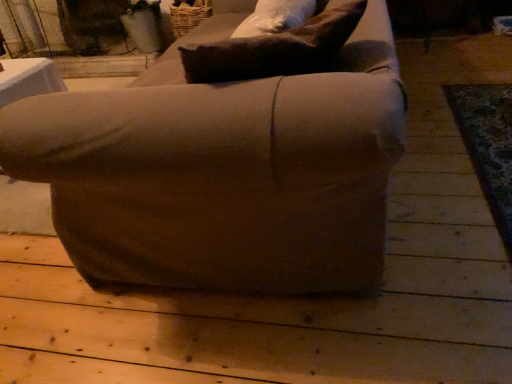
Where is `matte brown armchair at center`? The width and height of the screenshot is (512, 384). matte brown armchair at center is located at coordinates (223, 170).

Measure the distance between matte brown armchair at center and camera.

matte brown armchair at center and camera are 29.10 inches apart from each other.

This screenshot has width=512, height=384. What do you see at coordinates (223, 170) in the screenshot?
I see `matte brown armchair at center` at bounding box center [223, 170].

What do you see at coordinates (219, 62) in the screenshot? I see `brown fabric pillow at upper center` at bounding box center [219, 62].

The height and width of the screenshot is (384, 512). Find the location of `brown fabric pillow at upper center`. brown fabric pillow at upper center is located at coordinates (219, 62).

The width and height of the screenshot is (512, 384). Find the location of `matte brown armchair at center`. matte brown armchair at center is located at coordinates (223, 170).

In the image, is matte brown armchair at center on the left side or the right side of brown fabric pillow at upper center?

Based on their positions, matte brown armchair at center is located to the left of brown fabric pillow at upper center.

Which object is further away from the camera taking this photo, matte brown armchair at center or brown fabric pillow at upper center?

brown fabric pillow at upper center is more distant.

Does point (389, 150) come behind point (331, 48)?

No, it is not.

From the image's perspective, relative to brown fabric pillow at upper center, is matte brown armchair at center above or below?

matte brown armchair at center is above brown fabric pillow at upper center.

In the scene shown: From a real-world perspective, which object stands above the other?

brown fabric pillow at upper center, from a real-world perspective.

In terms of width, does matte brown armchair at center look wider or thinner when compared to brown fabric pillow at upper center?

Clearly, matte brown armchair at center has more width compared to brown fabric pillow at upper center.

Does matte brown armchair at center have a lesser height compared to brown fabric pillow at upper center?

Incorrect, the height of matte brown armchair at center does not fall short of that of brown fabric pillow at upper center.

Is matte brown armchair at center smaller than brown fabric pillow at upper center?

Incorrect, matte brown armchair at center is not smaller in size than brown fabric pillow at upper center.

In the scene shown: Would you say matte brown armchair at center is outside brown fabric pillow at upper center?

matte brown armchair at center lies outside brown fabric pillow at upper center's area.

Is matte brown armchair at center with brown fabric pillow at upper center?

There is a gap between matte brown armchair at center and brown fabric pillow at upper center.

Is matte brown armchair at center facing towards brown fabric pillow at upper center?

Yes.

Find the location of a particular element. Image resolution: width=512 pixels, height=384 pixels. chair below the brown fabric pillow at upper center (from a real-world perspective) is located at coordinates (223, 170).

Would you say brown fabric pillow at upper center is to the left or to the right of matte brown armchair at center in the picture?

From the image, it's evident that brown fabric pillow at upper center is to the right of matte brown armchair at center.

Which object is closer to the camera, brown fabric pillow at upper center or matte brown armchair at center?

matte brown armchair at center is more forward.

Which is closer, (222,79) or (237,140)?

Positioned in front is point (237,140).

From the image's perspective, is brown fabric pillow at upper center located above or below matte brown armchair at center?

brown fabric pillow at upper center is below matte brown armchair at center.

From a real-world perspective, does brown fabric pillow at upper center sit lower than matte brown armchair at center?

No.

Between brown fabric pillow at upper center and matte brown armchair at center, which one has larger width?

matte brown armchair at center is wider.

In terms of height, does brown fabric pillow at upper center look taller or shorter compared to matte brown armchair at center?

In the image, brown fabric pillow at upper center appears to be shorter than matte brown armchair at center.

Is brown fabric pillow at upper center bigger than matte brown armchair at center?

No, brown fabric pillow at upper center is not bigger than matte brown armchair at center.

Do you think brown fabric pillow at upper center is within matte brown armchair at center, or outside of it?

The correct answer is: inside.

From the picture: Are brown fabric pillow at upper center and matte brown armchair at center far apart?

No, brown fabric pillow at upper center is in close proximity to matte brown armchair at center.

Does brown fabric pillow at upper center turn towards matte brown armchair at center?

Yes.

How different are the orientations of brown fabric pillow at upper center and matte brown armchair at center in degrees?

0.000203 degrees.

You are a GUI agent. You are given a task and a screenshot of the screen. Output one action in this format:
    pyautogui.click(x=<x>, y=<y>)
    Task: Click on the chair in front of the brown fabric pillow at upper center
    This screenshot has height=384, width=512.
    Given the screenshot: What is the action you would take?
    pyautogui.click(x=223, y=170)

Find the location of a particular element. The width and height of the screenshot is (512, 384). chair beneath the brown fabric pillow at upper center (from a real-world perspective) is located at coordinates (223, 170).

You are a GUI agent. You are given a task and a screenshot of the screen. Output one action in this format:
    pyautogui.click(x=<x>, y=<y>)
    Task: Click on the pillow located on the right of matte brown armchair at center
    The image size is (512, 384).
    Given the screenshot: What is the action you would take?
    pyautogui.click(x=219, y=62)